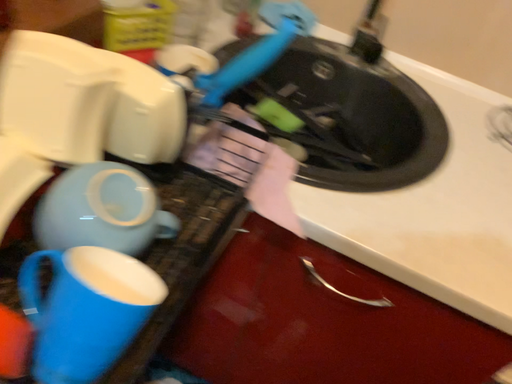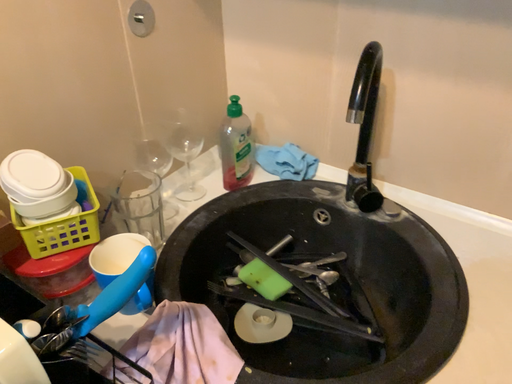
Question: Which way did the camera rotate in the video?

Choices:
 (A) rotated right
 (B) rotated left

Answer: (B)